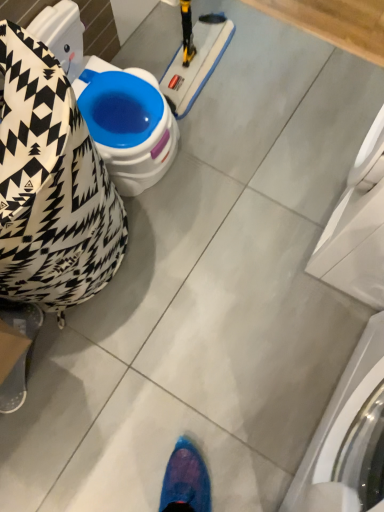
Question: Considering the relative positions of white glossy washing machine at lower right, arranged as the 1th washing machine when ordered from the bottom, and black and white patterned bean bag chair at left in the image provided, is white glossy washing machine at lower right, arranged as the 1th washing machine when ordered from the bottom, to the left of black and white patterned bean bag chair at left from the viewer's perspective?

Choices:
 (A) no
 (B) yes

Answer: (A)

Question: Can you confirm if white glossy washing machine at lower right, arranged as the 1th washing machine when ordered from the bottom, is smaller than black and white patterned bean bag chair at left?

Choices:
 (A) no
 (B) yes

Answer: (A)

Question: From the image's perspective, is white glossy washing machine at lower right, which is the second washing machine from top to bottom, under black and white patterned bean bag chair at left?

Choices:
 (A) no
 (B) yes

Answer: (B)

Question: Does white glossy washing machine at lower right, which is the second washing machine from top to bottom, have a lesser width compared to black and white patterned bean bag chair at left?

Choices:
 (A) no
 (B) yes

Answer: (B)

Question: Is white glossy washing machine at lower right, which is the second washing machine from top to bottom, shorter than black and white patterned bean bag chair at left?

Choices:
 (A) no
 (B) yes

Answer: (A)

Question: Looking at their shapes, would you say white glossy washing machine at right, the 2th washing machine from the bottom, is wider or thinner than black and white patterned bean bag chair at left?

Choices:
 (A) wide
 (B) thin

Answer: (B)

Question: Is white glossy washing machine at right, the 2th washing machine from the bottom, taller or shorter than black and white patterned bean bag chair at left?

Choices:
 (A) tall
 (B) short

Answer: (A)

Question: Do you think white glossy washing machine at right, arranged as the first washing machine when viewed from the top, is within black and white patterned bean bag chair at left, or outside of it?

Choices:
 (A) inside
 (B) outside

Answer: (B)

Question: From the image's perspective, is white glossy washing machine at right, the 2th washing machine from the bottom, located above or below black and white patterned bean bag chair at left?

Choices:
 (A) above
 (B) below

Answer: (A)

Question: Is point (375, 295) positioned closer to the camera than point (377, 498)?

Choices:
 (A) closer
 (B) farther

Answer: (B)

Question: In terms of width, does white glossy washing machine at right, arranged as the first washing machine when viewed from the top, look wider or thinner when compared to white glossy washing machine at lower right, arranged as the 1th washing machine when ordered from the bottom?

Choices:
 (A) wide
 (B) thin

Answer: (A)

Question: Based on their positions, is white glossy washing machine at right, arranged as the first washing machine when viewed from the top, located to the left or right of white glossy washing machine at lower right, arranged as the 1th washing machine when ordered from the bottom?

Choices:
 (A) left
 (B) right

Answer: (B)

Question: In terms of height, does white glossy washing machine at right, arranged as the first washing machine when viewed from the top, look taller or shorter compared to white glossy washing machine at lower right, arranged as the 1th washing machine when ordered from the bottom?

Choices:
 (A) tall
 (B) short

Answer: (A)

Question: Do you think black and white patterned bean bag chair at left is within white glossy washing machine at lower right, which is the second washing machine from top to bottom, or outside of it?

Choices:
 (A) inside
 (B) outside

Answer: (B)

Question: Visually, is black and white patterned bean bag chair at left positioned to the left or to the right of white glossy washing machine at lower right, which is the second washing machine from top to bottom?

Choices:
 (A) right
 (B) left

Answer: (B)